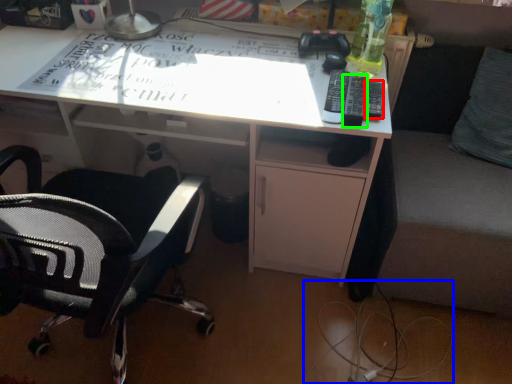
Question: Estimate the real-world distances between objects in this image. Which object is closer to remote (highlighted by a red box), wire (highlighted by a blue box) or remote (highlighted by a green box)?

Choices:
 (A) wire
 (B) remote

Answer: (B)